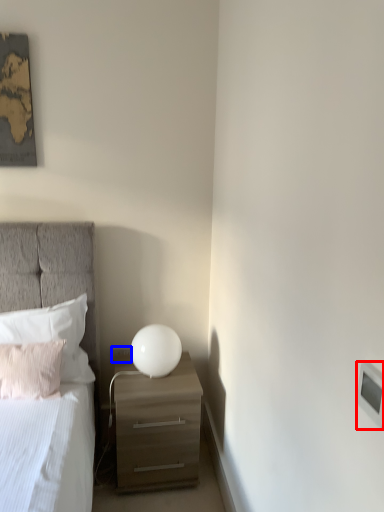
Question: Among these objects, which one is nearest to the camera, light switch (highlighted by a red box) or electric outlet (highlighted by a blue box)?

Choices:
 (A) light switch
 (B) electric outlet

Answer: (A)